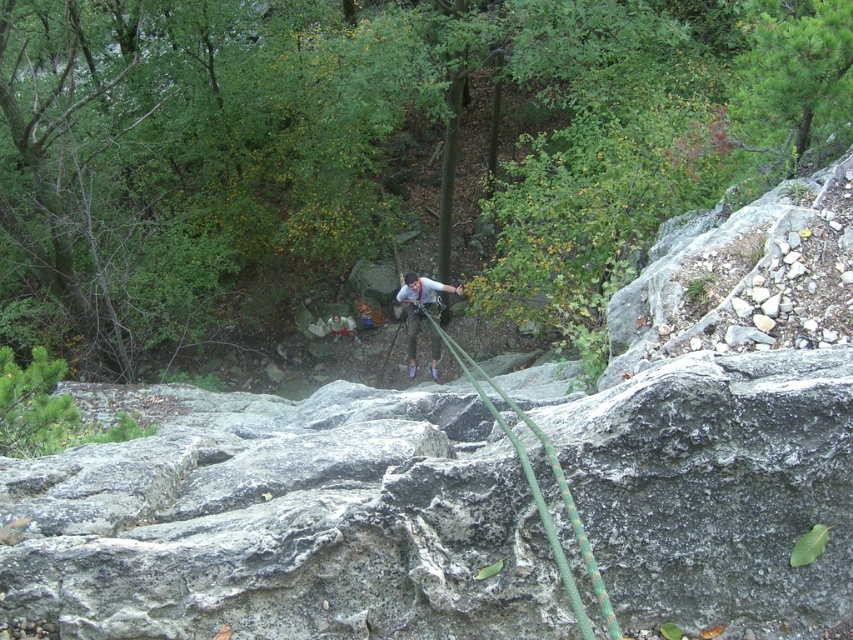
Question: Can you confirm if gray rough rock at center is smaller than matte gray climbing harness at center?

Choices:
 (A) no
 (B) yes

Answer: (B)

Question: Among these points, which one is farthest from the camera?

Choices:
 (A) [x=418, y=307]
 (B) [x=236, y=508]

Answer: (A)

Question: Does gray rough rock at center come behind matte gray climbing harness at center?

Choices:
 (A) yes
 (B) no

Answer: (B)

Question: Is gray rough rock at center closer to the viewer compared to matte gray climbing harness at center?

Choices:
 (A) no
 (B) yes

Answer: (B)